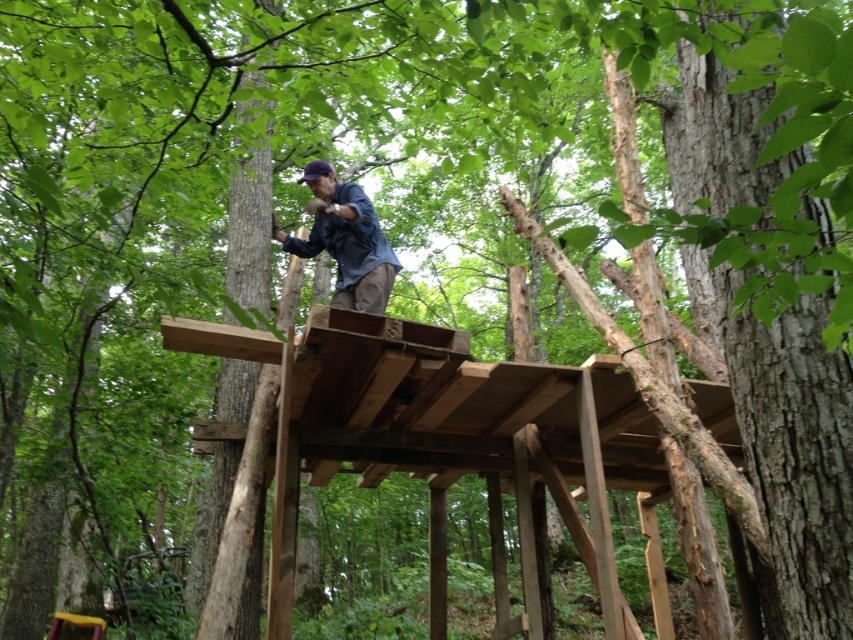
You are a hiker who wants to cross the natural wood platform at center. Considering your backpack takes up space, can you fit through the platform if the blue denim shirt at center is already occupying its narrower part?

The natural wood platform at center is wider than the blue denim shirt at center, so there should be enough space left for you and your backpack even if the blue denim shirt at center is occupying the narrower part.